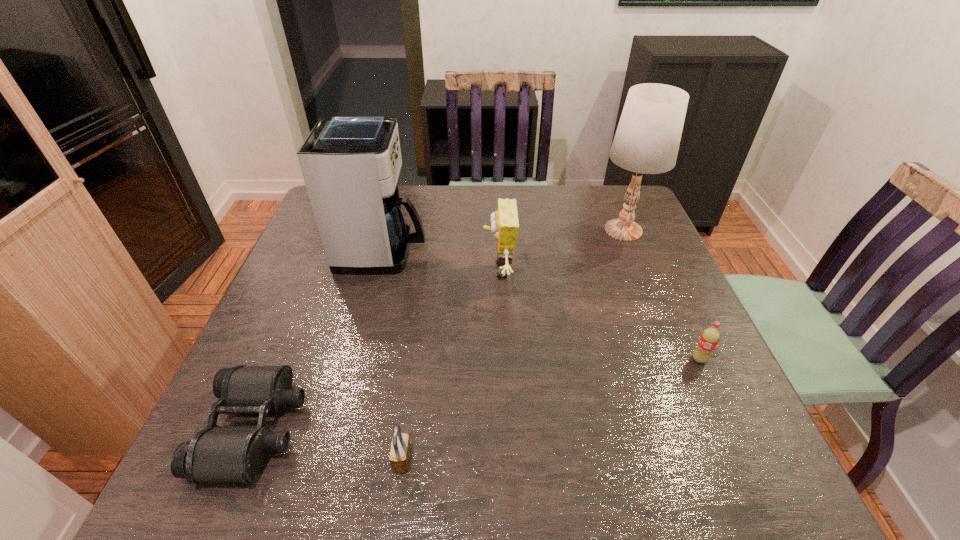
Where is `lamp located at the right edge`? The height and width of the screenshot is (540, 960). lamp located at the right edge is located at coordinates point(647,139).

Where is `soda present at the right edge`? soda present at the right edge is located at coordinates (709, 338).

Locate an element on the screen. Image resolution: width=960 pixels, height=540 pixels. object present at the near left corner is located at coordinates (217, 453).

In order to click on object at the far right corner in this screenshot , I will do `click(647, 139)`.

In the image, there is a desktop. What are the coordinates of `vacant space at the far edge` in the screenshot? It's located at (479, 210).

Find the location of a particular element. This screenshot has width=960, height=540. vacant space at the near edge of the desktop is located at coordinates (668, 457).

In the image, there is a desktop. In order to click on free space at the left edge in this screenshot , I will do `click(302, 294)`.

Where is `free location at the right edge`? free location at the right edge is located at coordinates (631, 295).

At what (x,y) coordinates should I click in order to perform the action: click on vacant space at the far right corner of the desktop. Please return your answer as a coordinate pair (x, y). Looking at the image, I should click on (595, 193).

The image size is (960, 540). Find the location of `free spot between the lamp and the shortest object`. free spot between the lamp and the shortest object is located at coordinates (439, 329).